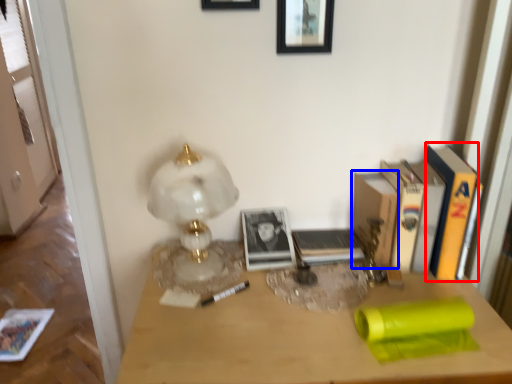
Question: Among these objects, which one is farthest to the camera, paperback book (highlighted by a red box) or paperback book (highlighted by a blue box)?

Choices:
 (A) paperback book
 (B) paperback book

Answer: (B)